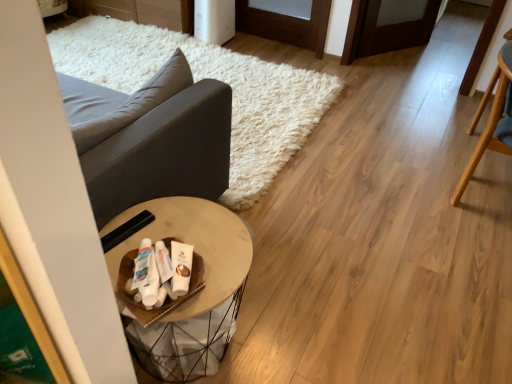
Image resolution: width=512 pixels, height=384 pixels. Find the location of `free space to the back side of white matte toothpaste tube at center, the third toiletry from the right`. free space to the back side of white matte toothpaste tube at center, the third toiletry from the right is located at coordinates (170, 229).